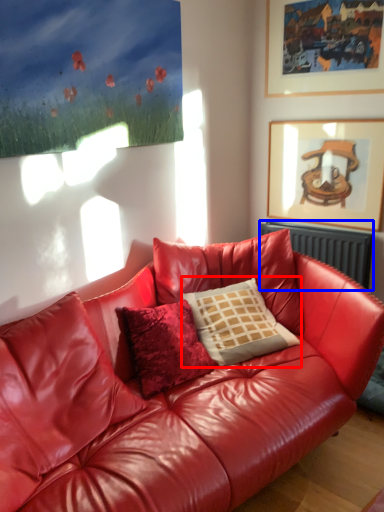
Question: Which point is further to the camera, pillow (highlighted by a red box) or radiator (highlighted by a blue box)?

Choices:
 (A) pillow
 (B) radiator

Answer: (B)